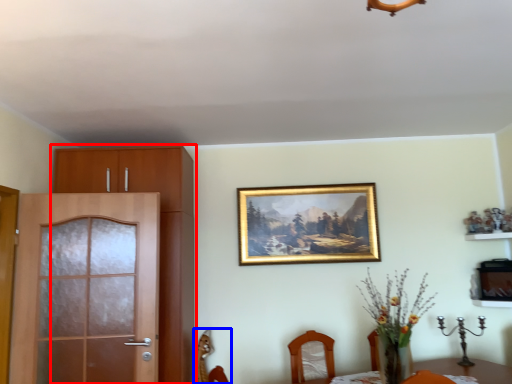
Question: Which object appears farthest to the camera in this image, cabinetry (highlighted by a red box) or chair (highlighted by a blue box)?

Choices:
 (A) cabinetry
 (B) chair

Answer: (B)